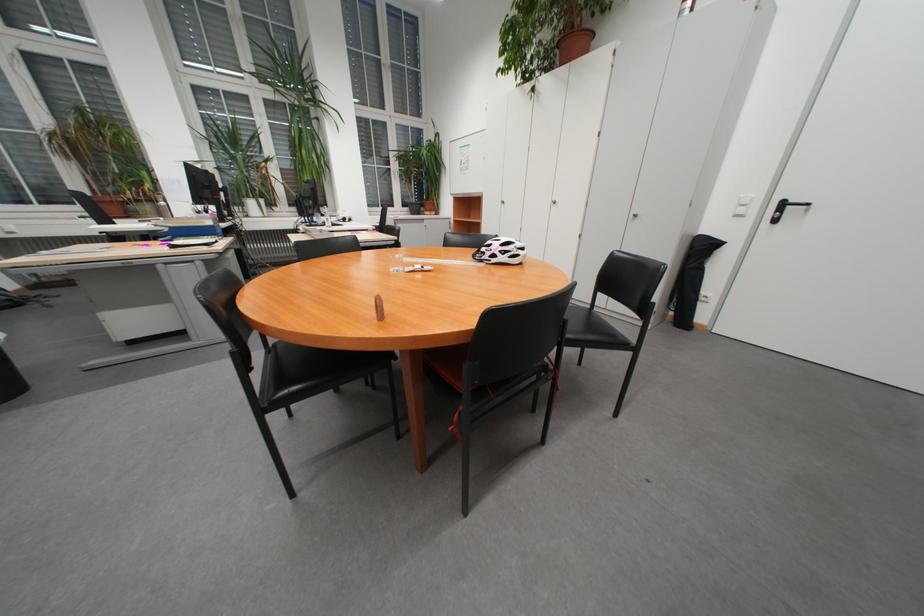
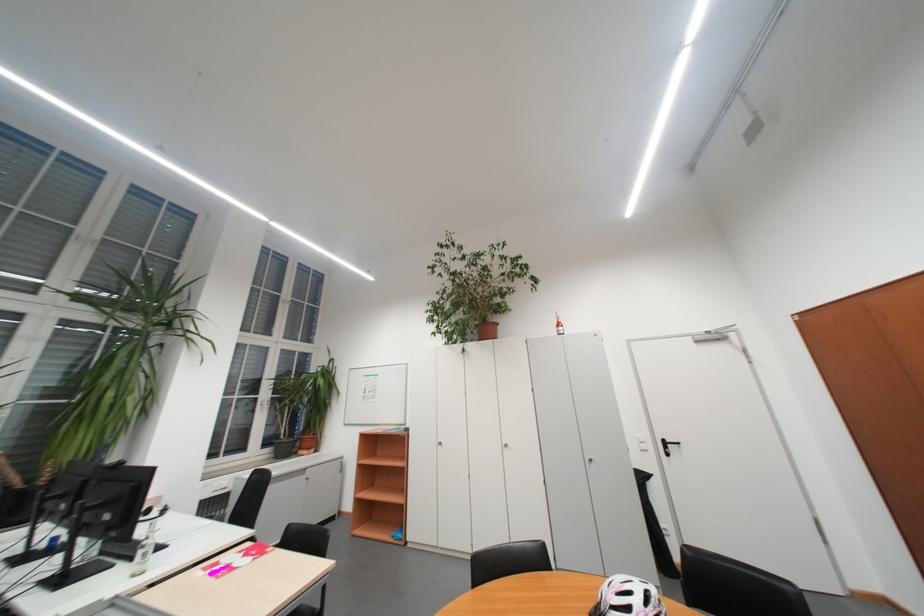
The point at [442,142] is marked in the first image. Where is the corresponding point in the second image?

(334, 368)